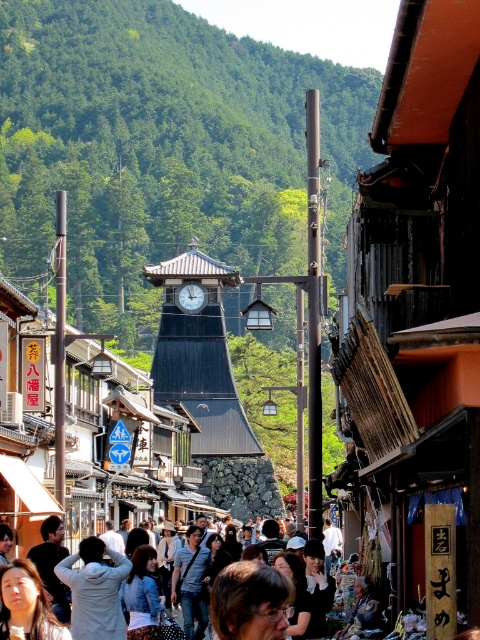
You are standing at the entrance of the street and want to reach the dark wood clock tower at center. Which direction should you walk to get there?

You should walk towards the end of the street where the dark wood clock tower at center is located, as it is situated at the focal point at the end of the street.

You are standing on the street and see the light brown hair at center and the matte black clock tower at center. Which object is positioned to the right side from your perspective?

The light brown hair at center is positioned to the right of the matte black clock tower at center.

Based on the scene description, where is the dark wood clock tower at center located in terms of its 2D coordinates?

The dark wood clock tower at center is located at coordinates (200, 355).